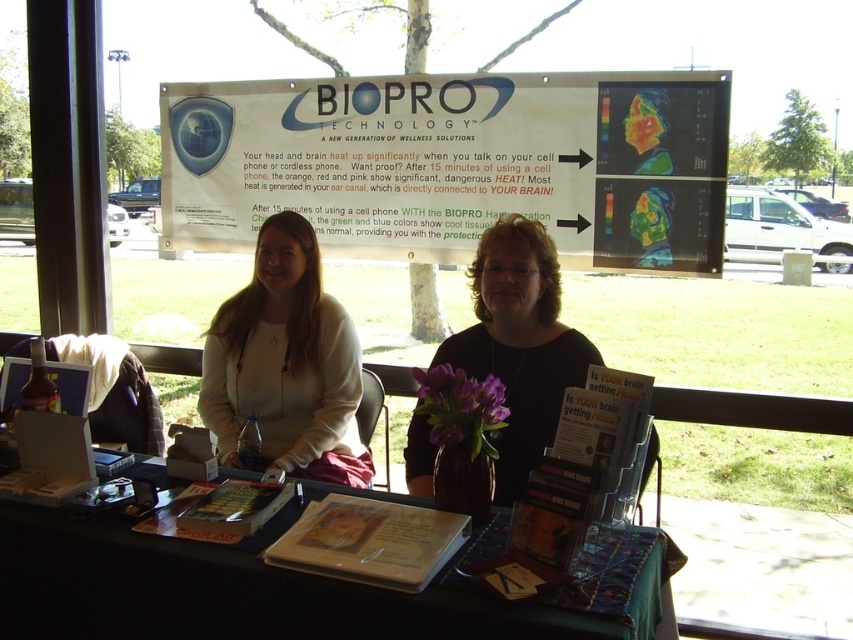
You are a photographer trying to capture a closeup of the BIOPRO Technology banner. You have two points marked in the image, point (254, 602) and point (498, 438). Which point should you focus on to get the closest part of the banner in sharp focus?

Point (254, 602) is closer to the camera than point (498, 438), so focusing on point (254, 602) will ensure the closest part of the banner is in sharp focus.

You are a customer at the BIOPRO Technology booth and want to read the white paper at upper center and the wooden table at center. Which item has a bigger surface area for placing your coffee cup?

The white paper at upper center has a larger size compared to the wooden table at center, so it has a bigger surface area for placing your coffee cup.